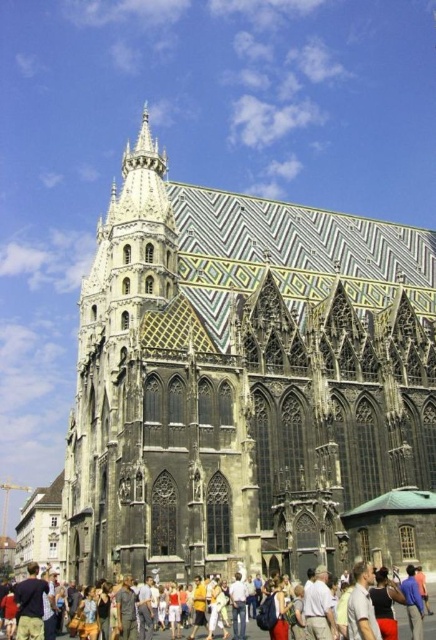
Question: Which point is farther to the camera?

Choices:
 (A) multicolored mosaic tile church at center
 (B) multicolored fabric crowd at lower center

Answer: (A)

Question: Which point appears closest to the camera in this image?

Choices:
 (A) pyautogui.click(x=251, y=499)
 (B) pyautogui.click(x=0, y=637)

Answer: (B)

Question: Which point is farther to the camera?

Choices:
 (A) multicolored mosaic tile church at center
 (B) multicolored fabric crowd at lower center

Answer: (A)

Question: Can you confirm if multicolored mosaic tile church at center is wider than multicolored fabric crowd at lower center?

Choices:
 (A) no
 (B) yes

Answer: (B)

Question: Is multicolored mosaic tile church at center above multicolored fabric crowd at lower center?

Choices:
 (A) yes
 (B) no

Answer: (A)

Question: Can you confirm if multicolored mosaic tile church at center is positioned to the left of multicolored fabric crowd at lower center?

Choices:
 (A) yes
 (B) no

Answer: (A)